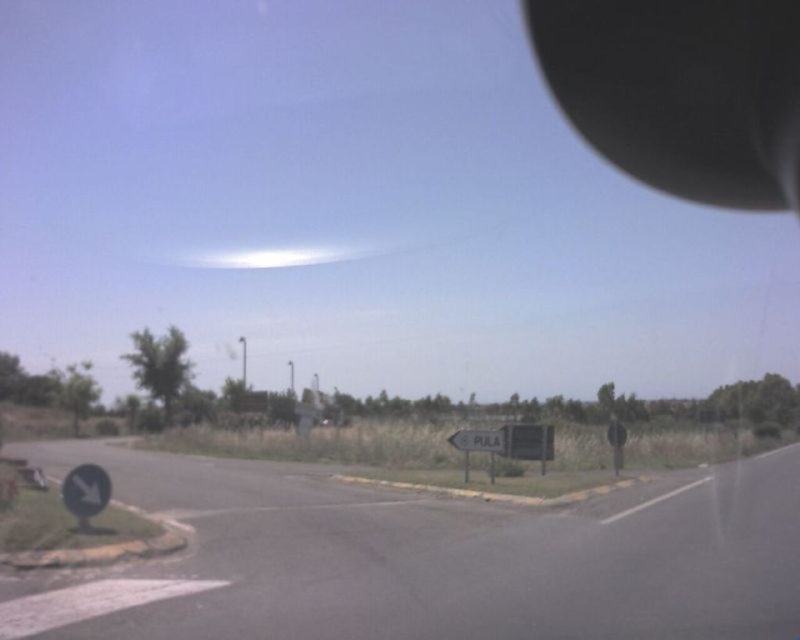
You are sitting in the driver seat of the car and want to check the black matte rearview mirror at upper right. Where exactly should you look to see it?

The black matte rearview mirror at upper right is located at point (682, 92), so you should look towards that coordinate to see it.